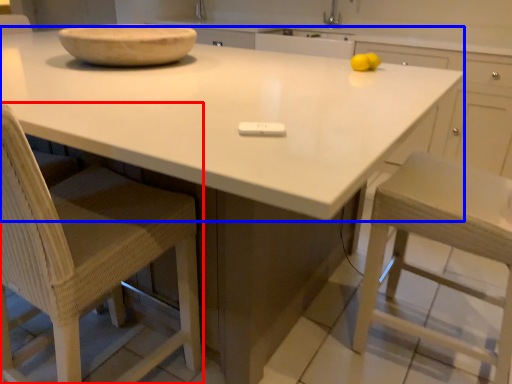
Question: Which object is closer to the camera taking this photo, chair (highlighted by a red box) or countertop (highlighted by a blue box)?

Choices:
 (A) chair
 (B) countertop

Answer: (B)